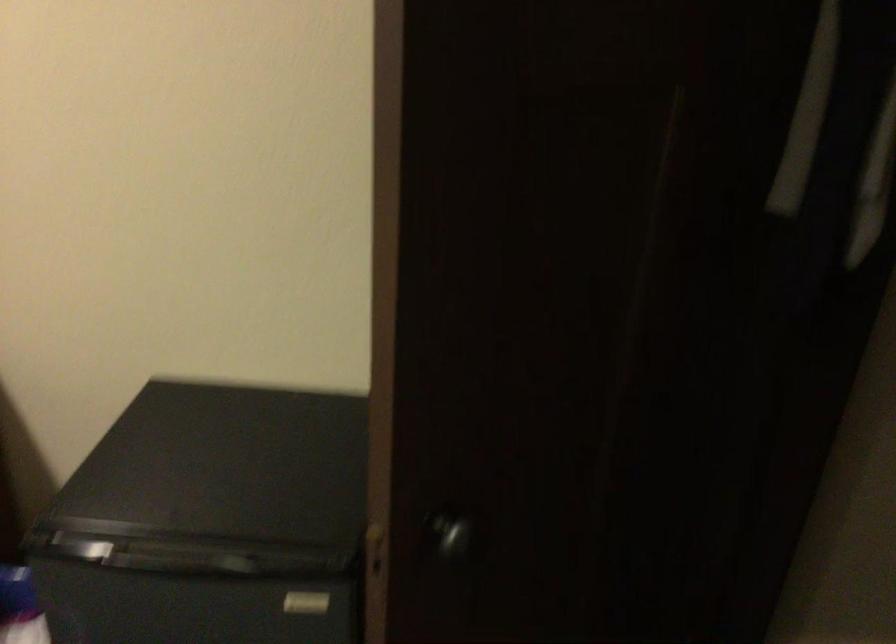
Where would you turn the doorknob? Please return your answer as a coordinate pair (x, y).

(451, 535)